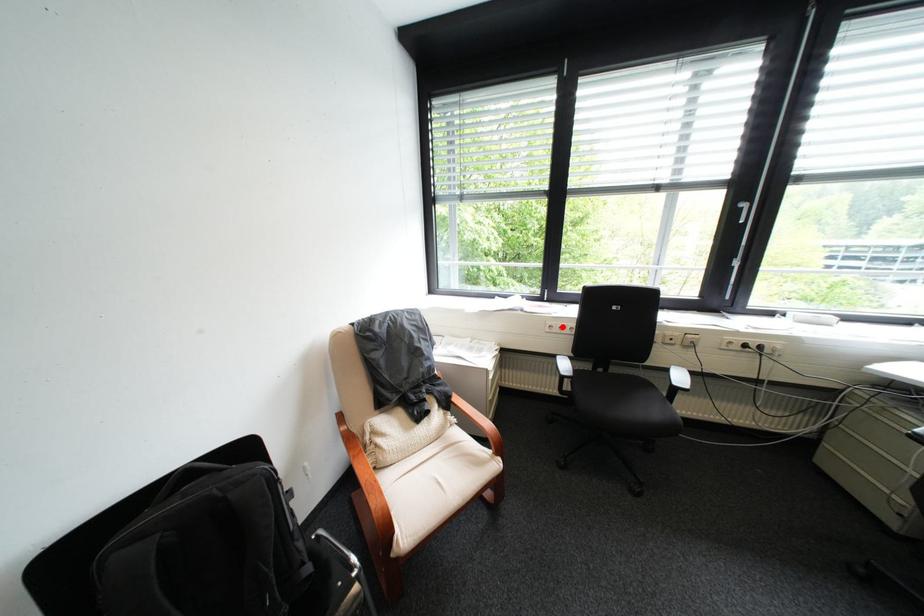
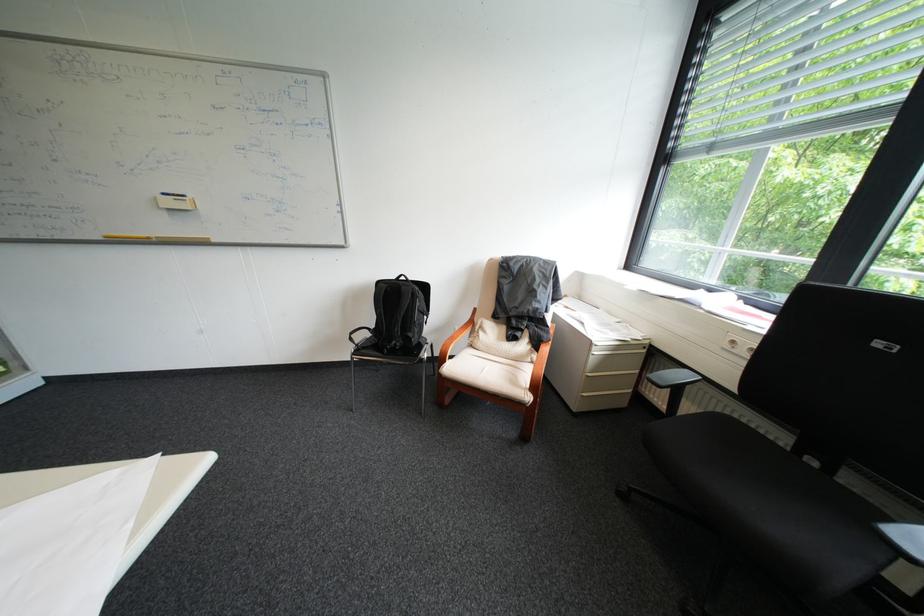
Where in the second image is the point corresponding to the highlighted location from the first image?

(746, 342)